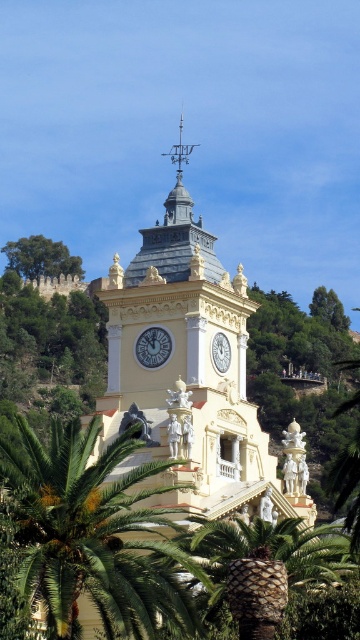
Question: Does green leafy palm tree at center appear under green leafy tree at upper left?

Choices:
 (A) no
 (B) yes

Answer: (B)

Question: Based on their relative distances, which object is nearer to the green leafy palm tree at lower center?

Choices:
 (A) green leafy tree at upper left
 (B) beige stone clock tower at center

Answer: (B)

Question: Which point is closer to the camera?

Choices:
 (A) (199, 392)
 (B) (219, 342)
 (C) (65, 248)
 (D) (141, 333)

Answer: (A)

Question: Does green leafy palm tree at lower center have a larger size compared to white glossy clock at upper center?

Choices:
 (A) yes
 (B) no

Answer: (A)

Question: Which of the following is the farthest from the observer?

Choices:
 (A) white glossy clock at center
 (B) green leafy palm tree at lower center
 (C) green leafy tree at upper left
 (D) beige stone clock tower at center

Answer: (C)

Question: Is green leafy palm tree at center positioned behind white glossy clock at upper center?

Choices:
 (A) no
 (B) yes

Answer: (A)